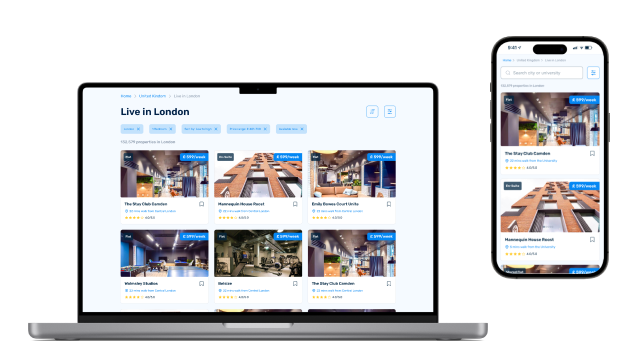
What are the coordinates of `laptop keyboard` in the screenshot? It's located at (305, 327).